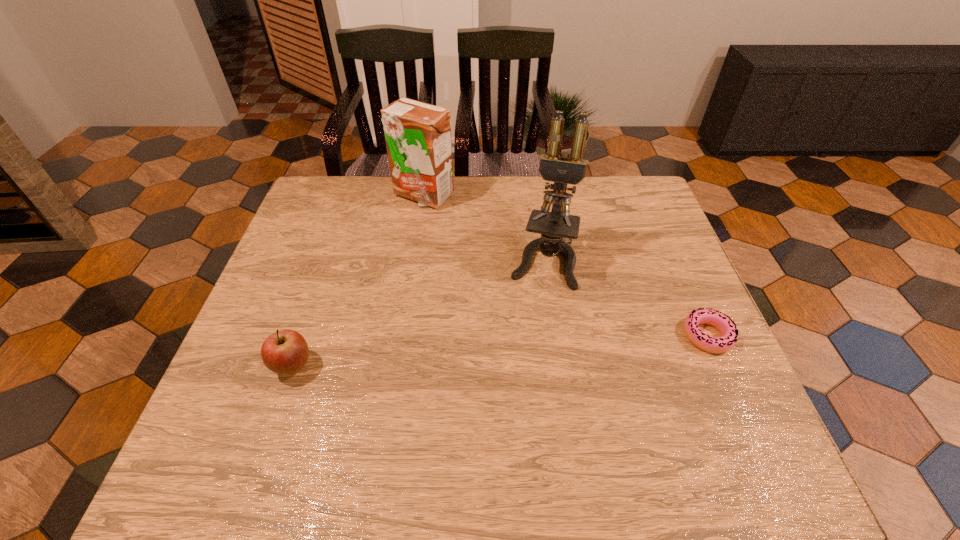
You are a GUI agent. You are given a task and a screenshot of the screen. Output one action in this format:
    pyautogui.click(x=<x>, y=<y>)
    Task: Click on the third tallest object
    Image resolution: width=960 pixels, height=540 pixels.
    Given the screenshot: What is the action you would take?
    pyautogui.click(x=285, y=352)

The height and width of the screenshot is (540, 960). I want to click on apple, so click(x=285, y=352).

Locate an element on the screen. This screenshot has height=540, width=960. doughnut is located at coordinates (x=722, y=322).

Where is `the rightmost object`? The width and height of the screenshot is (960, 540). the rightmost object is located at coordinates (722, 322).

The width and height of the screenshot is (960, 540). I want to click on the third object from left to right, so click(x=557, y=228).

At what (x,y) coordinates should I click in order to perform the action: click on the second farthest object. Please return your answer as a coordinate pair (x, y). The height and width of the screenshot is (540, 960). Looking at the image, I should click on (557, 228).

The width and height of the screenshot is (960, 540). I want to click on the second object from left to right, so click(x=418, y=135).

The width and height of the screenshot is (960, 540). Identify the location of the second tallest object. (418, 135).

This screenshot has height=540, width=960. What are the coordinates of `free location located on the right of the leftmost object` in the screenshot? It's located at (491, 367).

Locate an element on the screen. free space located 0.120m on the front of the doughnut is located at coordinates (739, 407).